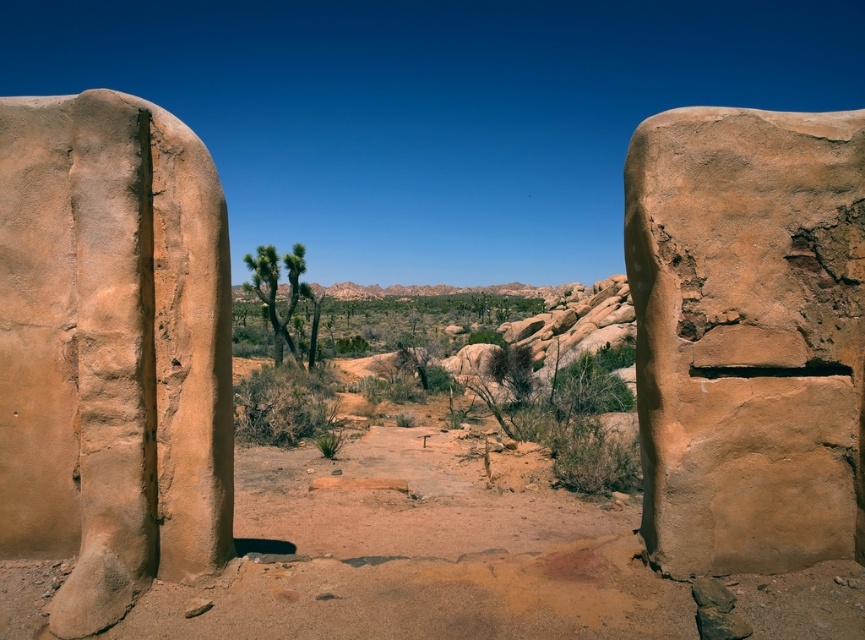
Between matte sandstone rock at left and matte sandstone boulder at right, which one is positioned higher?

matte sandstone rock at left

Does point (0, 509) come farther from viewer compared to point (789, 406)?

That is True.

Between point (178, 189) and point (798, 308), which one is positioned in front?

Point (798, 308) is more forward.

This screenshot has width=865, height=640. I want to click on matte sandstone rock at left, so click(x=111, y=349).